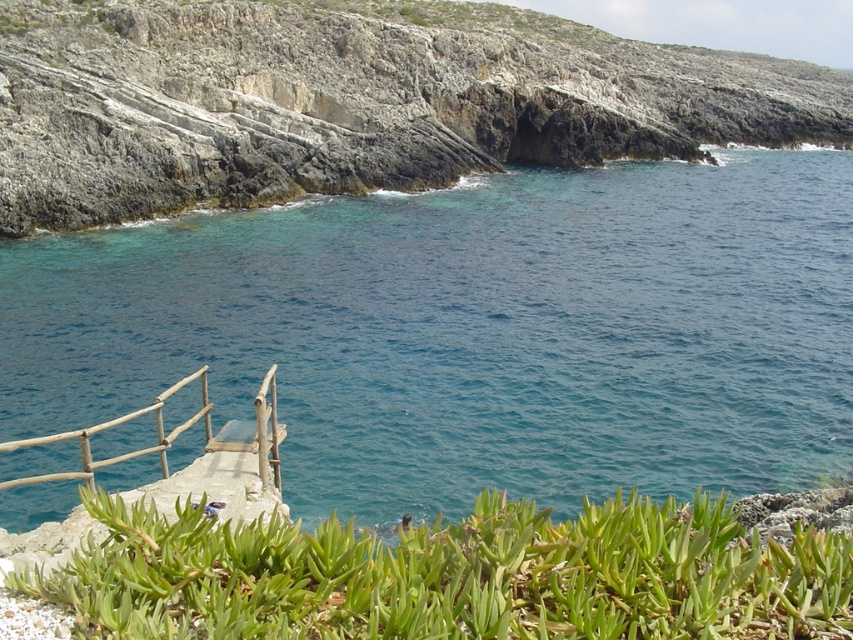
Question: Which object appears farthest from the camera in this image?

Choices:
 (A) wooden rail at lower left
 (B) green succulent at lower center
 (C) rugged stone cliff at upper center
 (D) blue water at upper center

Answer: (C)

Question: Does blue water at upper center appear over rugged stone cliff at upper center?

Choices:
 (A) no
 (B) yes

Answer: (A)

Question: Is blue water at upper center closer to the viewer compared to rugged stone cliff at upper center?

Choices:
 (A) yes
 (B) no

Answer: (A)

Question: Which object is farther from the camera taking this photo?

Choices:
 (A) wooden rail at lower left
 (B) green succulent at lower center
 (C) blue water at upper center

Answer: (C)

Question: From the image, what is the correct spatial relationship of rugged stone cliff at upper center in relation to wooden rail at lower left?

Choices:
 (A) right
 (B) left

Answer: (A)

Question: Estimate the real-world distances between objects in this image. Which object is closer to the blue water at upper center?

Choices:
 (A) green succulent at lower center
 (B) wooden rail at lower left

Answer: (A)